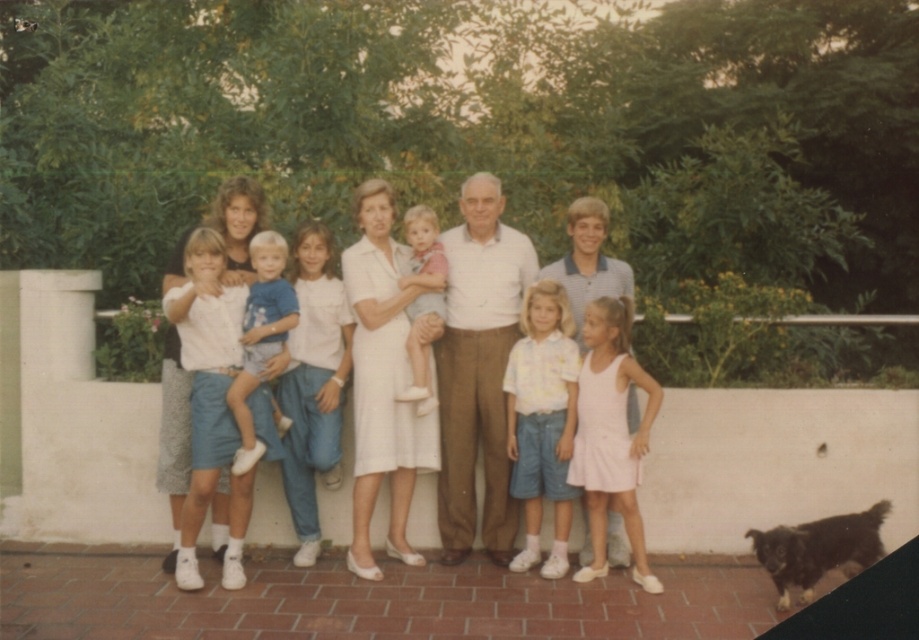
Does white cotton dress at center appear on the left side of light pink fabric baby at center?

Incorrect, white cotton dress at center is not on the left side of light pink fabric baby at center.

Is the position of white cotton dress at center less distant than that of light pink fabric baby at center?

That is True.

I want to click on white cotton dress at center, so click(x=498, y=452).

Who is more forward, (x=495, y=410) or (x=395, y=544)?

Point (x=495, y=410) is more forward.

Is point (458, 500) closer to viewer compared to point (367, 515)?

No, it is not.

The width and height of the screenshot is (919, 640). Find the location of `white cotton shirt at center`. white cotton shirt at center is located at coordinates (478, 369).

Is point (458, 412) behind point (248, 445)?

Yes, it is behind point (248, 445).

Who is higher up, white cotton shirt at center or blue denim shorts at center?

blue denim shorts at center is above.

Image resolution: width=919 pixels, height=640 pixels. I want to click on white cotton shirt at center, so click(x=478, y=369).

Locate an element on the screen. Image resolution: width=919 pixels, height=640 pixels. white cotton shirt at center is located at coordinates (478, 369).